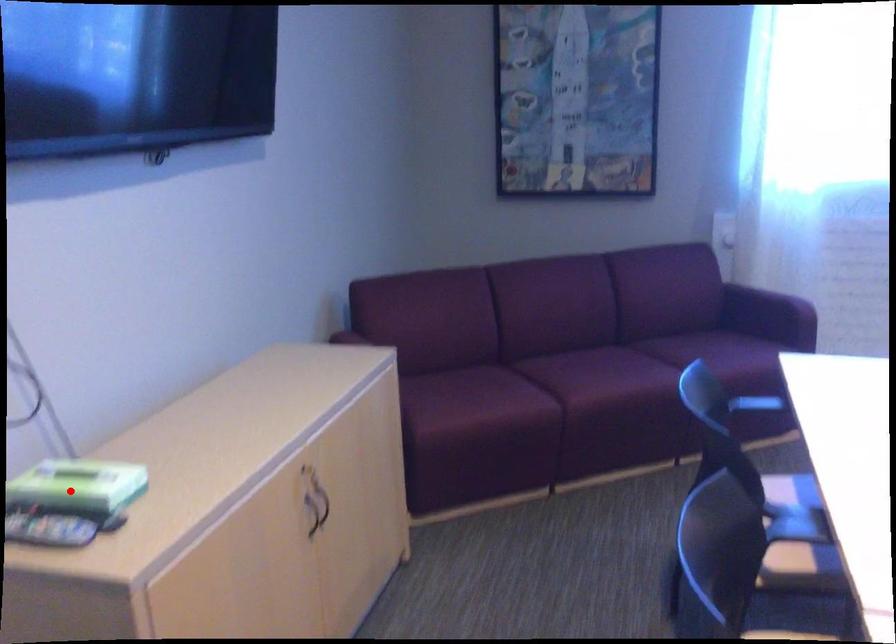
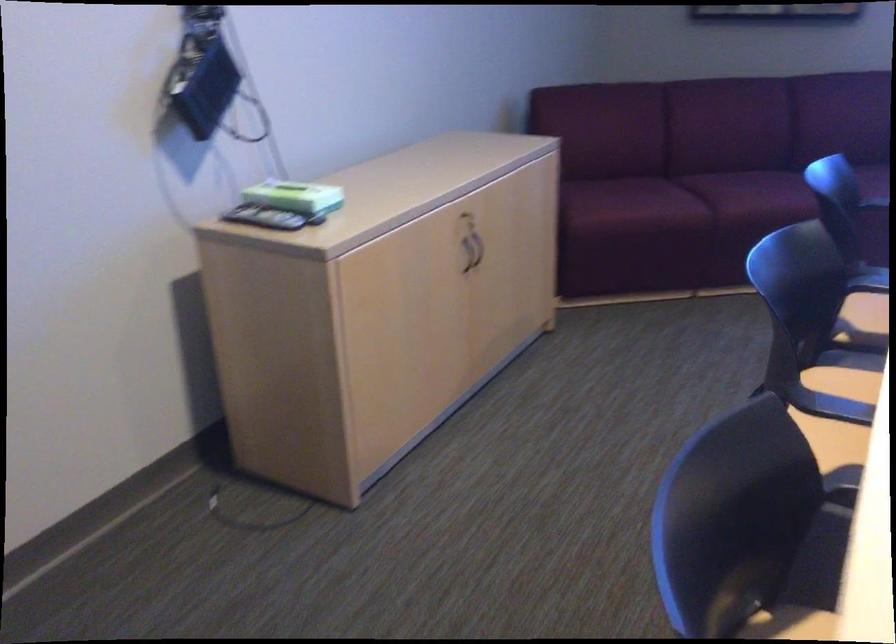
Question: I am providing you with two images of the same scene from different viewpoints. Image1 has a red point marked. In image2, the corresponding 3D location appears at what relative position? Reply with the corresponding letter.

Choices:
 (A) Closer
 (B) Farther

Answer: (B)